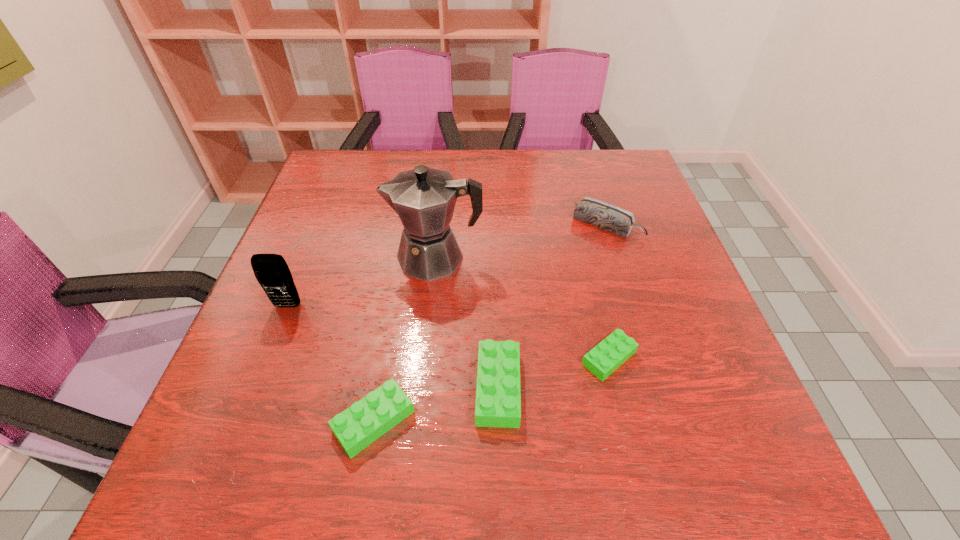
Identify the location of free space for a new Lego on the right. Image resolution: width=960 pixels, height=540 pixels. (708, 331).